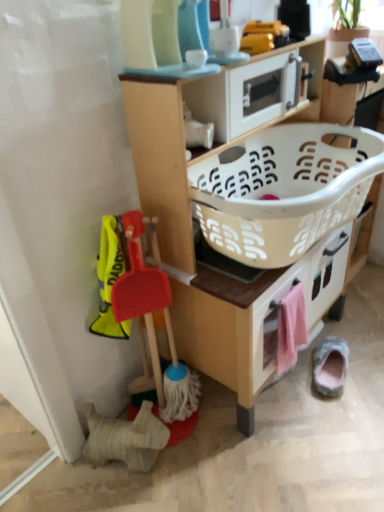
Question: From a real-world perspective, is white plastic basket at center located higher than gray suede slipper at lower right?

Choices:
 (A) yes
 (B) no

Answer: (A)

Question: Is white plastic basket at center positioned far away from gray suede slipper at lower right?

Choices:
 (A) no
 (B) yes

Answer: (A)

Question: Can gray suede slipper at lower right be found inside white plastic basket at center?

Choices:
 (A) no
 (B) yes

Answer: (A)

Question: Is white plastic basket at center bigger than gray suede slipper at lower right?

Choices:
 (A) no
 (B) yes

Answer: (B)

Question: From a real-world perspective, is white plastic basket at center physically below gray suede slipper at lower right?

Choices:
 (A) yes
 (B) no

Answer: (B)

Question: In the image, is white plastic microwave at upper center on the left side or the right side of pink fabric drawer at lower right?

Choices:
 (A) right
 (B) left

Answer: (B)

Question: Considering the positions of white plastic microwave at upper center and pink fabric drawer at lower right in the image, is white plastic microwave at upper center taller or shorter than pink fabric drawer at lower right?

Choices:
 (A) tall
 (B) short

Answer: (B)

Question: In the image, is white plastic microwave at upper center positioned in front of or behind pink fabric drawer at lower right?

Choices:
 (A) behind
 (B) front

Answer: (B)

Question: Is white plastic microwave at upper center bigger or smaller than pink fabric drawer at lower right?

Choices:
 (A) big
 (B) small

Answer: (A)

Question: From the image's perspective, is white plastic microwave at upper center above or below wooden toy kitchen at center?

Choices:
 (A) above
 (B) below

Answer: (A)

Question: Does point (236, 91) appear closer or farther from the camera than point (225, 252)?

Choices:
 (A) farther
 (B) closer

Answer: (B)

Question: Relative to wooden toy kitchen at center, is white plastic microwave at upper center in front or behind?

Choices:
 (A) behind
 (B) front

Answer: (A)

Question: Looking at their shapes, would you say white plastic microwave at upper center is wider or thinner than wooden toy kitchen at center?

Choices:
 (A) thin
 (B) wide

Answer: (A)

Question: Is wooden toy kitchen at center bigger or smaller than white plastic microwave at upper center?

Choices:
 (A) big
 (B) small

Answer: (A)

Question: From a real-world perspective, is wooden toy kitchen at center physically located above or below white plastic microwave at upper center?

Choices:
 (A) below
 (B) above

Answer: (A)